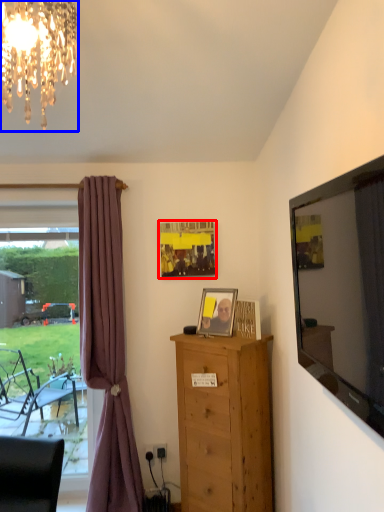
Question: Which of the following is the farthest to the observer, picture frame (highlighted by a red box) or lamp (highlighted by a blue box)?

Choices:
 (A) picture frame
 (B) lamp

Answer: (A)